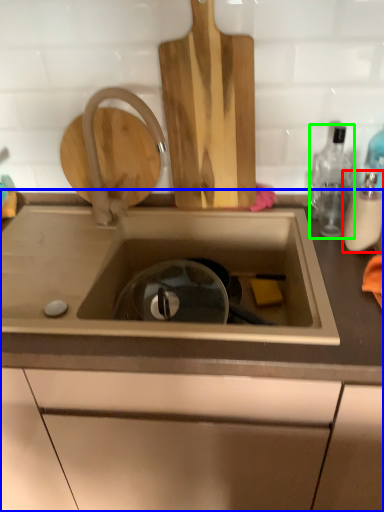
Question: Estimate the real-world distances between objects in this image. Which object is closer to bottle (highlighted by a red box), countertop (highlighted by a blue box) or bottle (highlighted by a green box)?

Choices:
 (A) countertop
 (B) bottle

Answer: (B)